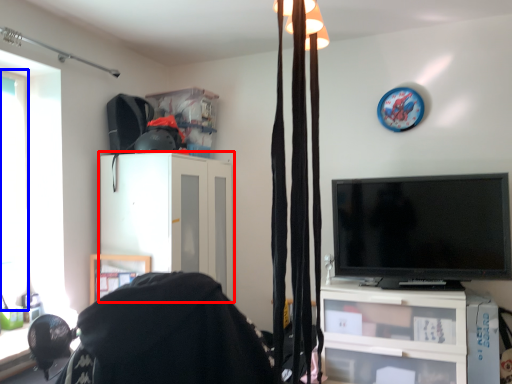
Question: Among these objects, which one is nearest to the camera, cabinetry (highlighted by a red box) or window (highlighted by a blue box)?

Choices:
 (A) cabinetry
 (B) window

Answer: (B)